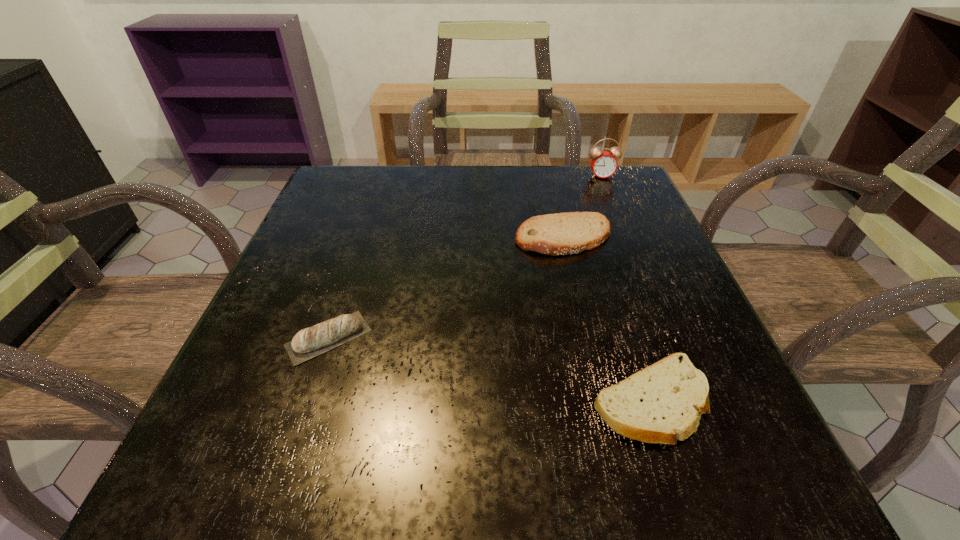
I want to click on the tallest object, so click(x=603, y=164).

What are the coordinates of `alarm clock` in the screenshot? It's located at (603, 164).

I want to click on the second farthest object, so click(x=567, y=233).

The image size is (960, 540). In order to click on the leftmost pita bread in this screenshot , I will do `click(310, 342)`.

You are a GUI agent. You are given a task and a screenshot of the screen. Output one action in this format:
    pyautogui.click(x=<x>, y=<y>)
    Task: Click on the shortest object
    This screenshot has height=540, width=960.
    Given the screenshot: What is the action you would take?
    pyautogui.click(x=659, y=404)

Locate an element on the screen. Image resolution: width=960 pixels, height=540 pixels. free space located on the clock face of the tallest object is located at coordinates (618, 216).

Locate an element on the screen. vacant space situated 0.090m on the right of the farthest pita bread is located at coordinates (657, 238).

Find the location of a particular element. blank space located 0.280m on the back of the leftmost pita bread is located at coordinates (368, 218).

Identify the location of blank space located on the left of the shortest object. (330, 401).

Where is `object present at the far edge`? This screenshot has height=540, width=960. object present at the far edge is located at coordinates (603, 164).